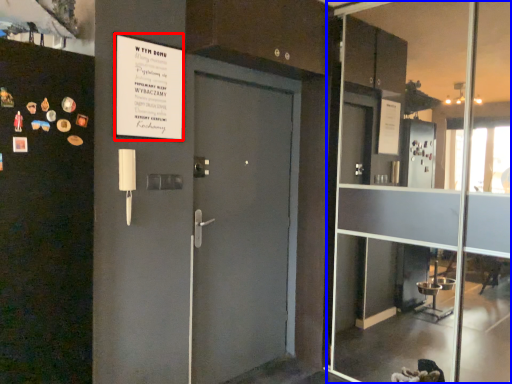
Question: Which point is further to the camera, poster (highlighted by a red box) or glass door (highlighted by a blue box)?

Choices:
 (A) poster
 (B) glass door

Answer: (A)